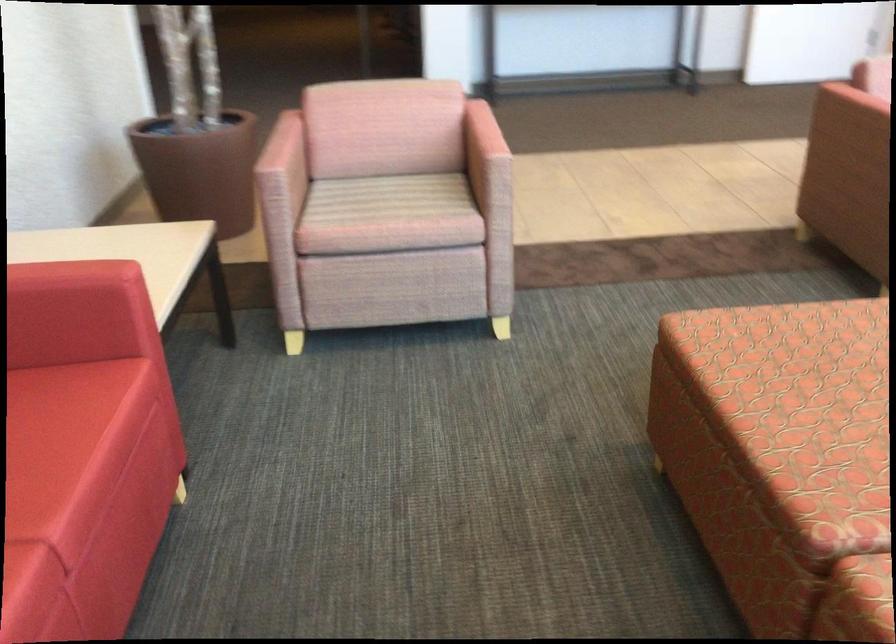
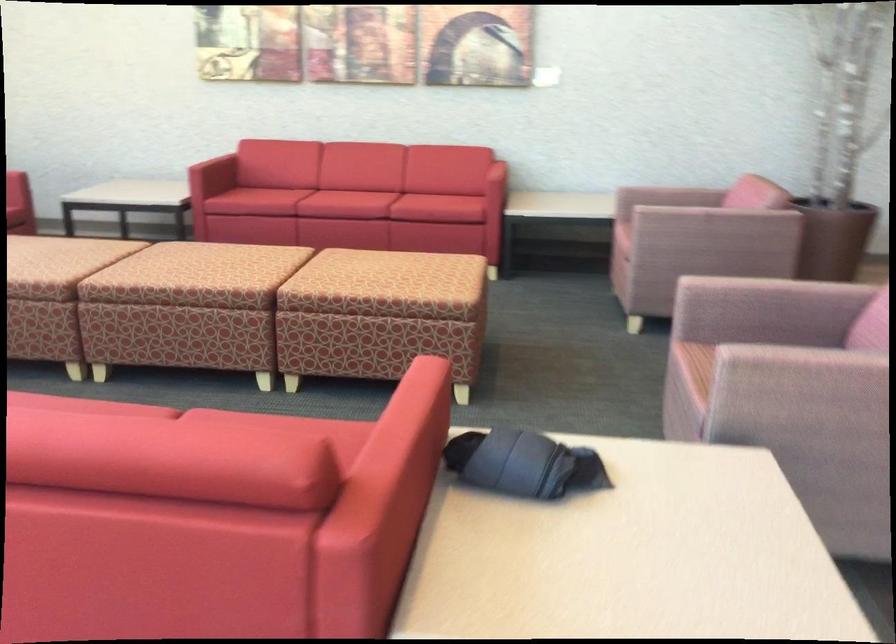
Locate, in the second image, the point that corresponds to [343,167] in the first image.

(669, 196)